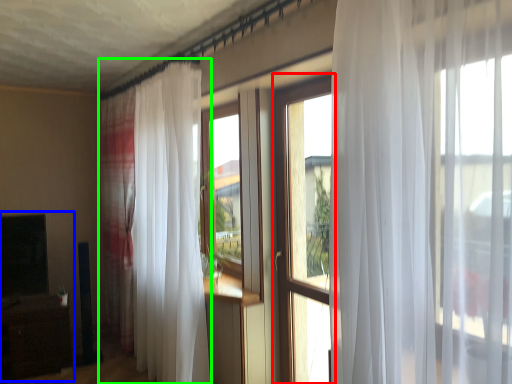
Question: Which object is positioned farthest from window (highlighted by a red box)? Select from entertainment center (highlighted by a blue box) and curtain (highlighted by a green box).

Choices:
 (A) entertainment center
 (B) curtain

Answer: (A)